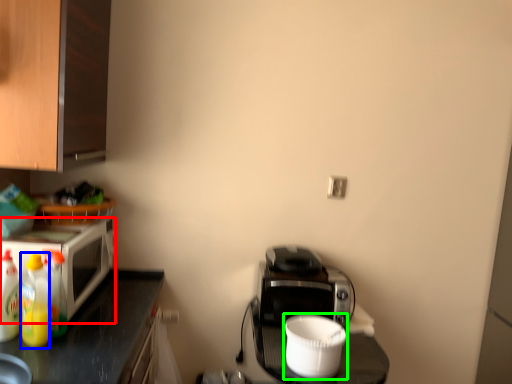
Question: Based on their relative distances, which object is nearer to microwave oven (highlighted by a red box)? Choose from bottle (highlighted by a blue box) and appliance (highlighted by a green box).

Choices:
 (A) bottle
 (B) appliance

Answer: (A)